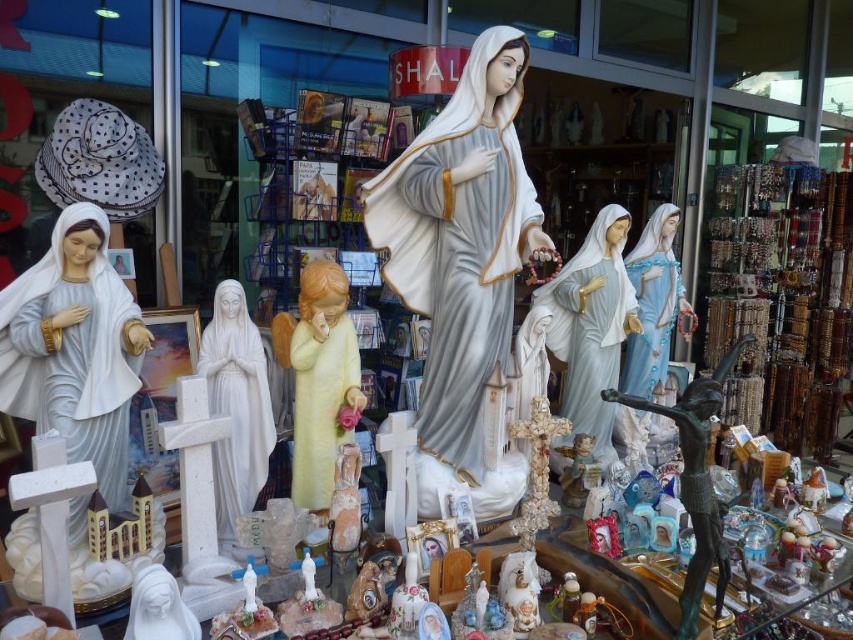
You are setting up a display and need to place the yellow matte angel at center and the matte blue fabric statue at right on a shelf that can only hold items narrower than 30 cm. According to the scene description, which of the two items can safely be placed on the shelf?

The yellow matte angel at center has a width less than the matte blue fabric statue at right, so the yellow matte angel at center can be safely placed on the shelf since it is narrower than 30 cm.

You are a delivery person who needs to place a new religious item between the white porcelain statue at left and the white porcelain statue at center. The item is 1.2 meters long. Will there be enough space between them to fit it?

The distance between the white porcelain statue at left and the white porcelain statue at center is 1.35 meters. Since the item is 1.2 meters long, there is enough space to fit it between them.